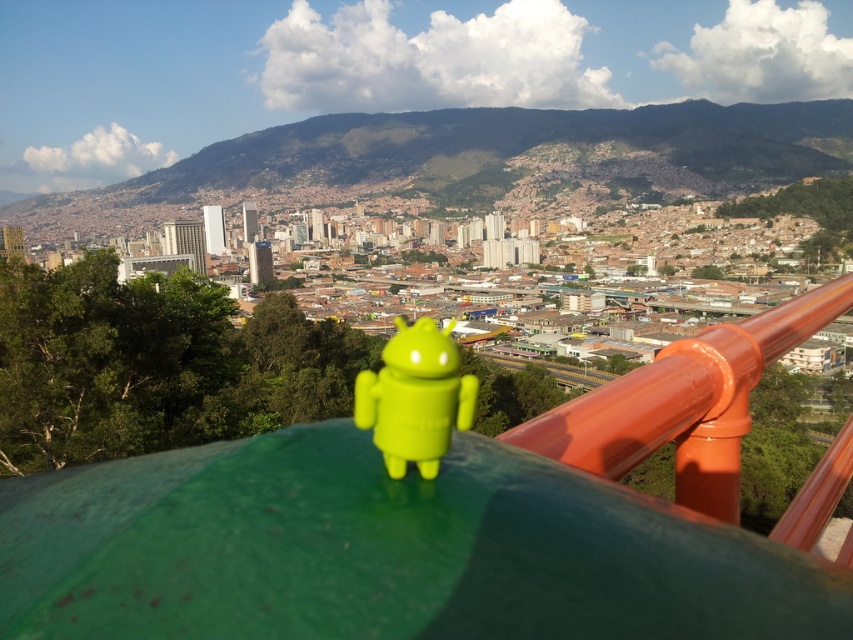
Does orange glossy rail at upper right have a larger size compared to green matte android figure at center?

Correct, orange glossy rail at upper right is larger in size than green matte android figure at center.

Between point (836, 298) and point (357, 376), which one is positioned in front?

Point (836, 298) is in front.

The height and width of the screenshot is (640, 853). Identify the location of orange glossy rail at upper right. (683, 403).